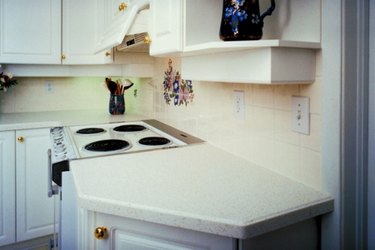
The width and height of the screenshot is (375, 250). I want to click on cup, so click(241, 19).